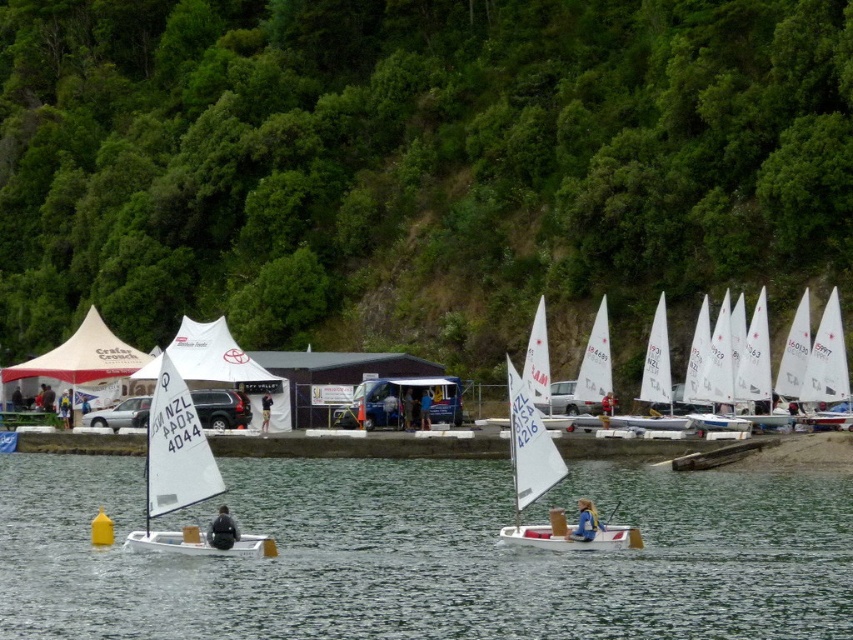
Identify the location of dark blue fabric shirt at center. The image size is (853, 640). (425, 410).

Does point (424, 404) come farther from viewer compared to point (268, 392)?

No.

Between point (422, 410) and point (270, 406), which one is positioned behind?

The point (270, 406) is behind.

Image resolution: width=853 pixels, height=640 pixels. I want to click on dark blue fabric shirt at center, so click(x=425, y=410).

Does black fabric jacket at lower center have a larger size compared to blue fabric person at center?

Incorrect, black fabric jacket at lower center is not larger than blue fabric person at center.

What do you see at coordinates (222, 531) in the screenshot? I see `black fabric jacket at lower center` at bounding box center [222, 531].

Which is behind, point (229, 529) or point (584, 508)?

The point (584, 508) is behind.

You are a GUI agent. You are given a task and a screenshot of the screen. Output one action in this format:
    pyautogui.click(x=<x>, y=<y>)
    Task: Click on the black fabric jacket at lower center
    This screenshot has height=640, width=853.
    Given the screenshot: What is the action you would take?
    pyautogui.click(x=222, y=531)

Who is more distant from viewer, (581,540) or (263,412)?

The point (263,412) is behind.

Between blue fabric person at center and dark blue fabric pants at center, which one appears on the right side from the viewer's perspective?

blue fabric person at center

Which is in front, point (590, 504) or point (267, 420)?

Point (590, 504) is in front.

Image resolution: width=853 pixels, height=640 pixels. What are the coordinates of `blue fabric person at center` in the screenshot? It's located at (585, 522).